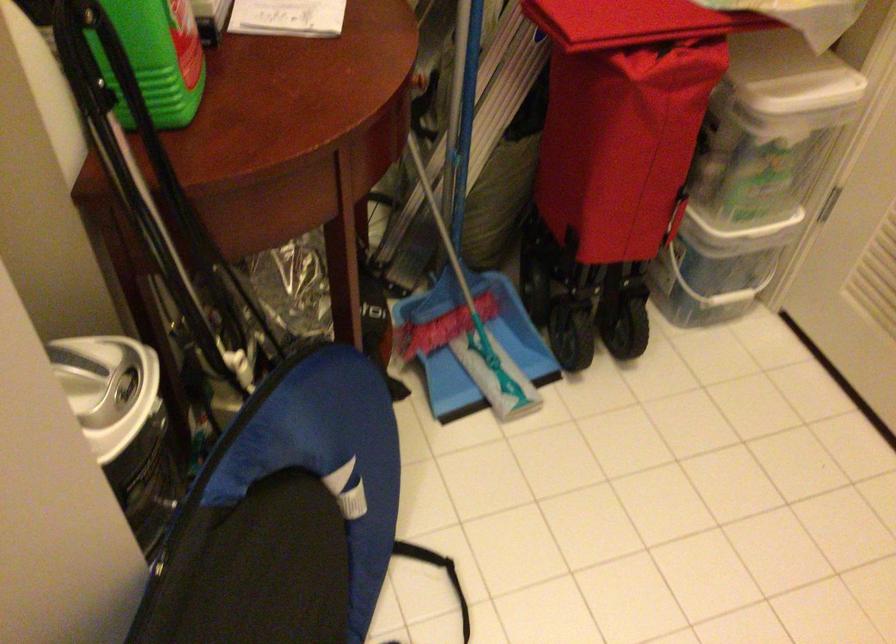
The width and height of the screenshot is (896, 644). What are the coordinates of `clear storage bin` in the screenshot? It's located at (752, 174).